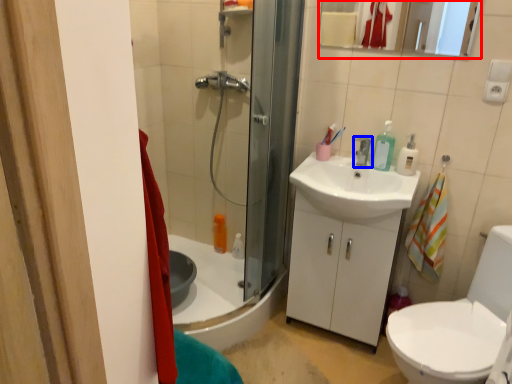
Question: Which point is closer to the camera, mirror (highlighted by a red box) or tap (highlighted by a blue box)?

Choices:
 (A) mirror
 (B) tap

Answer: (A)